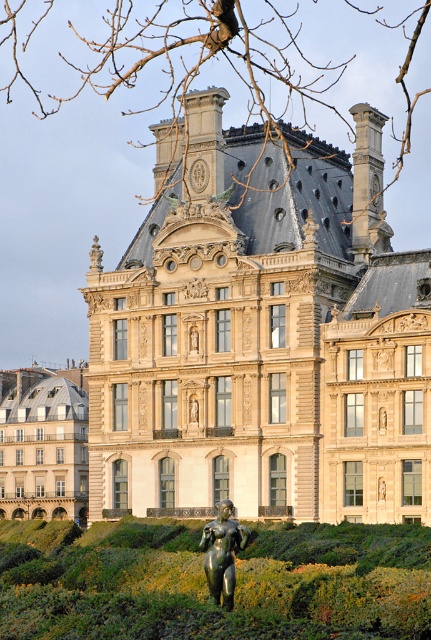
Question: Which point appears farthest from the camera in this image?

Choices:
 (A) (72, 460)
 (B) (291, 141)

Answer: (A)

Question: Is green grass at lower center to the left of bronze statue at center from the viewer's perspective?

Choices:
 (A) no
 (B) yes

Answer: (B)

Question: Which object is positioned closest to the green grass at lower center?

Choices:
 (A) beige stone building at lower left
 (B) beige stone palace at center

Answer: (B)

Question: Which point appears farthest from the camera in this image?

Choices:
 (A) (43, 417)
 (B) (124, 577)
 (C) (427, 257)

Answer: (A)

Question: Can you confirm if beige stone palace at center is smaller than beige stone building at lower left?

Choices:
 (A) yes
 (B) no

Answer: (B)

Question: Observing the image, what is the correct spatial positioning of beige stone palace at center in reference to green grass at lower center?

Choices:
 (A) below
 (B) above

Answer: (B)